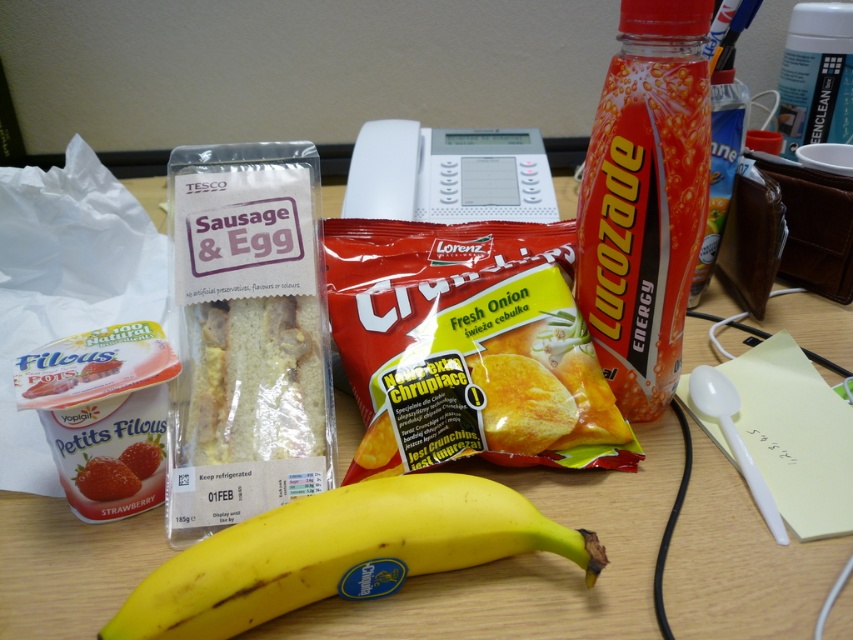
Question: Which object is farther from the camera taking this photo?

Choices:
 (A) yellow matte banana at center
 (B) yellow crunchy chips at center
 (C) orange glossy lucozade energy drink at upper right

Answer: (B)

Question: Does yellow matte banana at center come behind orange glossy lucozade energy drink at upper right?

Choices:
 (A) yes
 (B) no

Answer: (B)

Question: Which object is the farthest from the orange glossy lucozade energy drink at upper right?

Choices:
 (A) yellow matte banana at center
 (B) yellow crunchy chips at center

Answer: (A)

Question: Does yellow crunchy chips at center appear on the right side of orange glossy lucozade energy drink at upper right?

Choices:
 (A) no
 (B) yes

Answer: (A)

Question: Can you confirm if yellow crunchy chips at center is thinner than yellow matte banana at center?

Choices:
 (A) yes
 (B) no

Answer: (A)

Question: Among these objects, which one is farthest from the camera?

Choices:
 (A) orange glossy lucozade energy drink at upper right
 (B) yellow crunchy chips at center
 (C) yellow matte banana at center

Answer: (B)